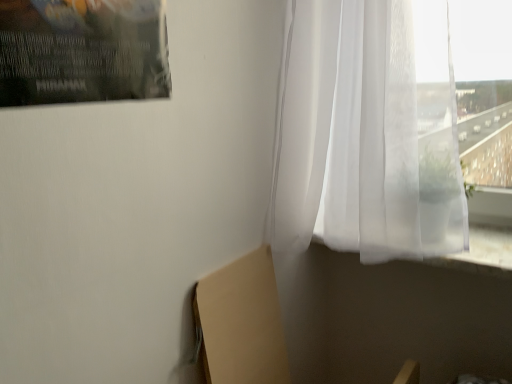
Question: Should I look upward or downward to see beige cardboard at lower left?

Choices:
 (A) down
 (B) up

Answer: (A)

Question: Should I look upward or downward to see translucent white curtain at upper right?

Choices:
 (A) down
 (B) up

Answer: (B)

Question: From the image's perspective, would you say beige cardboard at lower left is positioned over translucent white curtain at upper right?

Choices:
 (A) no
 (B) yes

Answer: (A)

Question: Are beige cardboard at lower left and translucent white curtain at upper right far apart?

Choices:
 (A) yes
 (B) no

Answer: (B)

Question: Considering the relative sizes of beige cardboard at lower left and translucent white curtain at upper right in the image provided, is beige cardboard at lower left smaller than translucent white curtain at upper right?

Choices:
 (A) yes
 (B) no

Answer: (A)

Question: Is beige cardboard at lower left in front of translucent white curtain at upper right?

Choices:
 (A) no
 (B) yes

Answer: (A)

Question: From a real-world perspective, is beige cardboard at lower left beneath translucent white curtain at upper right?

Choices:
 (A) yes
 (B) no

Answer: (A)

Question: Could you tell me if beige cardboard at lower left is facing translucent white curtain at upper right?

Choices:
 (A) no
 (B) yes

Answer: (A)

Question: Is translucent white curtain at upper right thinner than beige cardboard at lower left?

Choices:
 (A) yes
 (B) no

Answer: (B)

Question: From the image's perspective, is translucent white curtain at upper right below beige cardboard at lower left?

Choices:
 (A) no
 (B) yes

Answer: (A)

Question: Is translucent white curtain at upper right outside beige cardboard at lower left?

Choices:
 (A) no
 (B) yes

Answer: (B)

Question: Is translucent white curtain at upper right oriented towards beige cardboard at lower left?

Choices:
 (A) no
 (B) yes

Answer: (A)

Question: Considering the relative sizes of translucent white curtain at upper right and beige cardboard at lower left in the image provided, is translucent white curtain at upper right smaller than beige cardboard at lower left?

Choices:
 (A) no
 (B) yes

Answer: (A)

Question: Can you confirm if translucent white curtain at upper right is positioned to the left of beige cardboard at lower left?

Choices:
 (A) yes
 (B) no

Answer: (B)

Question: Is translucent white curtain at upper right wider or thinner than beige cardboard at lower left?

Choices:
 (A) thin
 (B) wide

Answer: (B)